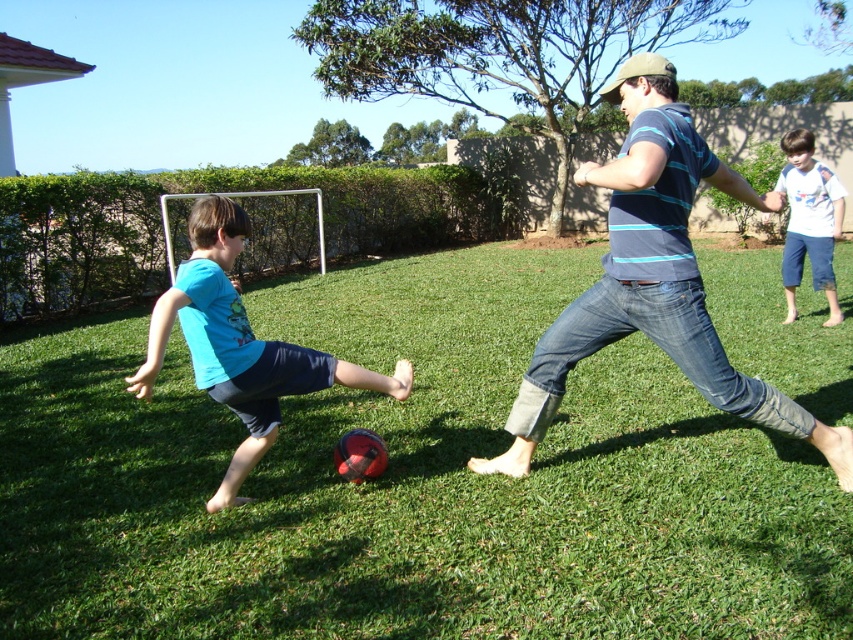
In the scene shown: Based on the provided coordinates, can you identify which object corresponds to the point at (408,483)?

The point at (408,483) corresponds to the green grass at center.

You are a photographer trying to capture a wide shot of both the blue striped shirt at center and the white cotton shirt at upper right. Based on their positions and sizes, do you think you can fit both into your camera frame without moving the camera? Explain your reasoning.

The blue striped shirt at center might be wider than the white cotton shirt at upper right, so there is a possibility that the blue striped shirt at center could occupy more space in the frame. However, since both are positioned at different areas, it depends on the camera angle and zoom. Without specific measurements, it is uncertain if both can fit without moving the camera.

You are standing at the point marked by coordinates (408,483) in the image. What is the immediate surface you are standing on?

The point marked by coordinates (408,483) is on the green grass at center.